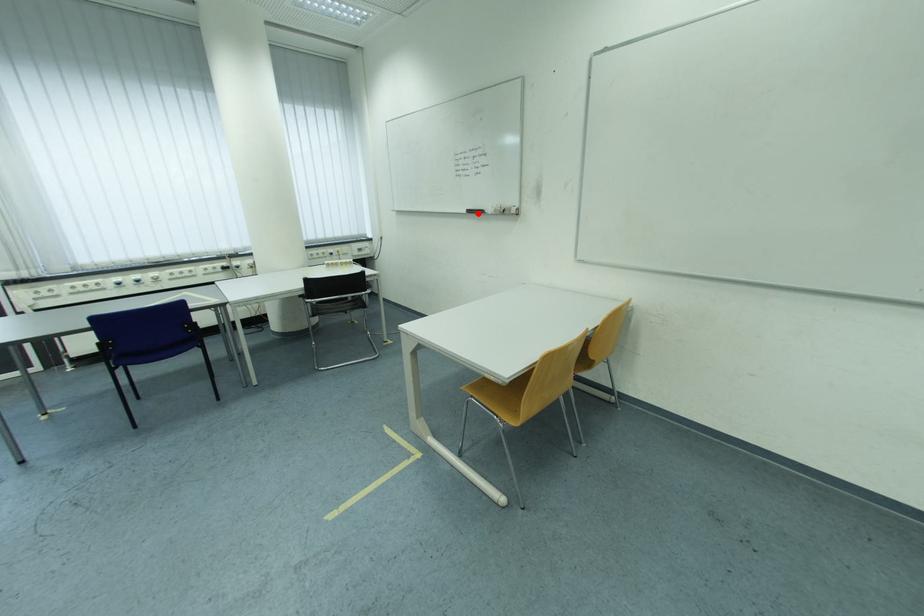
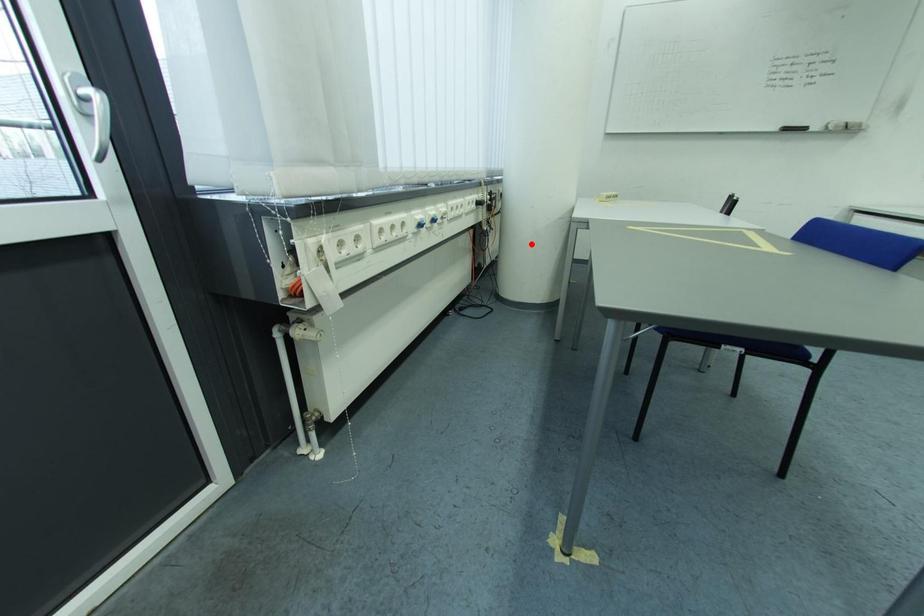
I am providing you with two images of the same scene from different viewpoints. A red point is marked on the first image and another point is marked on the second image. Does the point marked in image1 correspond to the same location as the one in image2?

No